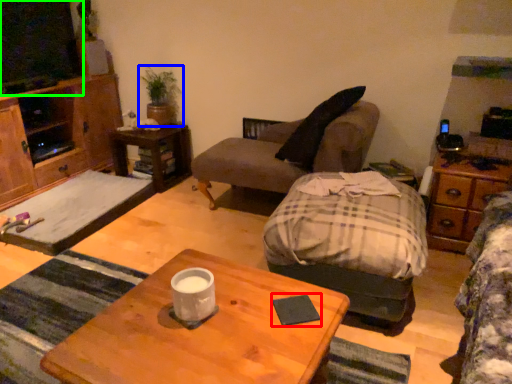
Question: Estimate the real-world distances between objects in this image. Which object is farther from pad (highlighted by a red box), houseplant (highlighted by a blue box) or television (highlighted by a green box)?

Choices:
 (A) houseplant
 (B) television

Answer: (B)